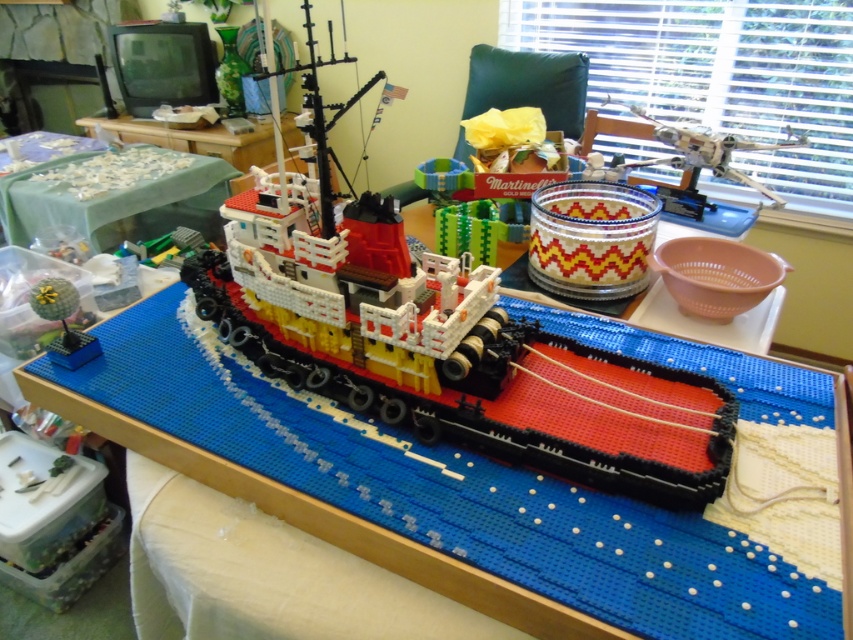
You are looking at the LEGO tugboat model from the front. There are two points marked on the tugboat deck at coordinates point (585, 440) and point (653, 128). Which point is closer to your viewpoint?

Point (585, 440) is closer to the camera than point (653, 128).